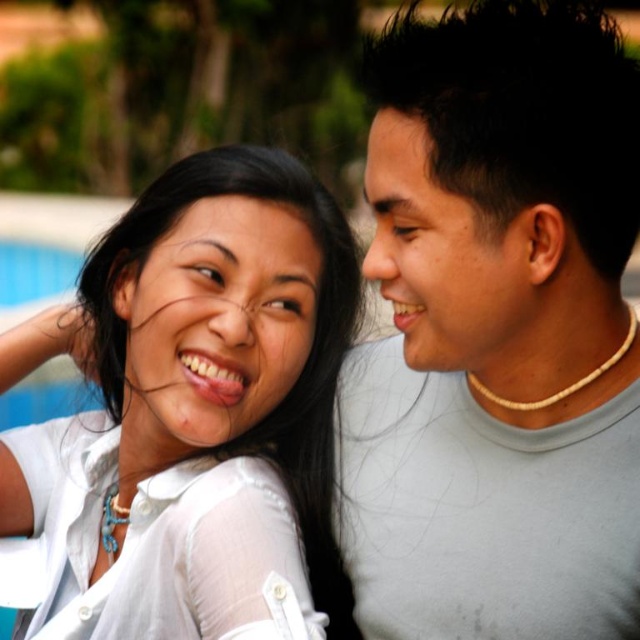
Based on the photo, you are designing a new clothing line and want to ensure proper sizing. If you have a mannequin that fits the gray matte shirt at center perfectly, will it also fit the white matte shirt at upper left?

The gray matte shirt at center is smaller than the white matte shirt at upper left. Therefore, the mannequin that fits the gray matte shirt at center may not fit the white matte shirt at upper left since it is larger.

You are a photographer trying to capture a closeup of the gray matte shirt at center and the white matte shirt at upper left. Which one would appear larger in your photo?

The gray matte shirt at center appears larger in the photo because it is closer to the viewer than the white matte shirt at upper left.

You are a photographer trying to capture a candid shot of both the gray matte shirt at center and the white matte shirt at upper left. Based on their positions, which shirt should you focus on first to ensure both are in frame?

The gray matte shirt at center is above the white matte shirt at upper left, so you should focus on the white matte shirt at upper left first to ensure both are in frame.